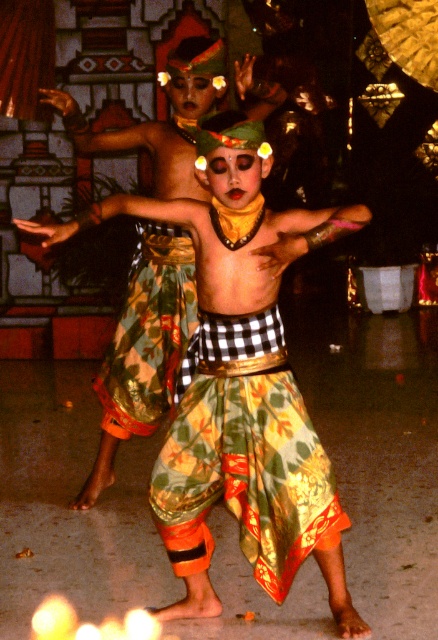
You are a photographer trying to capture the printed silk skirt at center during a Balinese dance performance. Based on its position coordinates, where should you aim your camera to ensure the skirt is centered in your shot?

The printed silk skirt at center is located at coordinates point (243, 454), so you should aim your camera at that specific point to center the skirt in your shot.

You are a photographer at a Balinese dance performance. You need to capture the printed silk skirt at center and the printed fabric dancer at center in a single shot. Since the skirt is to the right of the dancer, where should you position your camera relative to the dancer to ensure both are in frame?

The printed silk skirt at center is to the right of the printed fabric dancer at center, so positioning the camera to the right of the dancer will ensure both the skirt and the dancer are captured in the frame.